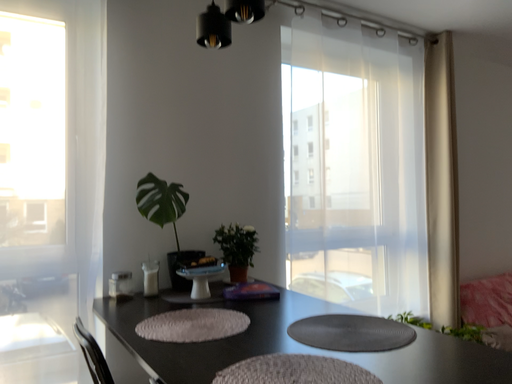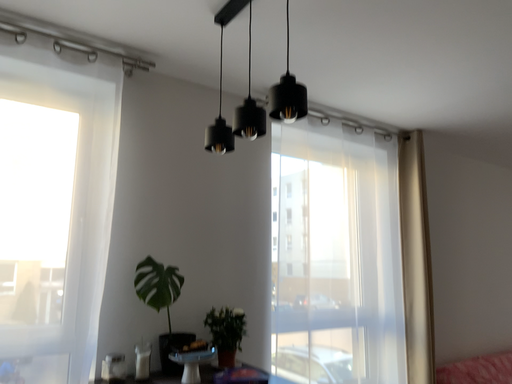
Question: How did the camera likely rotate when shooting the video?

Choices:
 (A) rotated downward
 (B) rotated upward

Answer: (B)